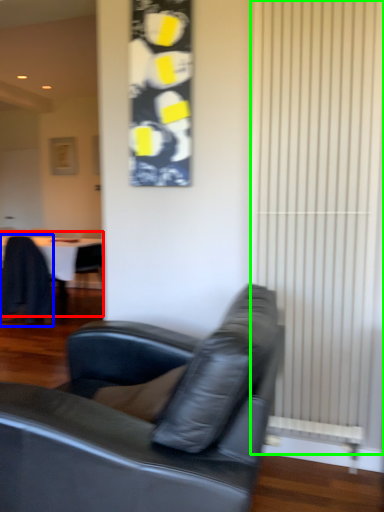
Question: Which is farther away from table (highlighted by a red box)? chair (highlighted by a blue box) or curtain (highlighted by a green box)?

Choices:
 (A) chair
 (B) curtain

Answer: (B)